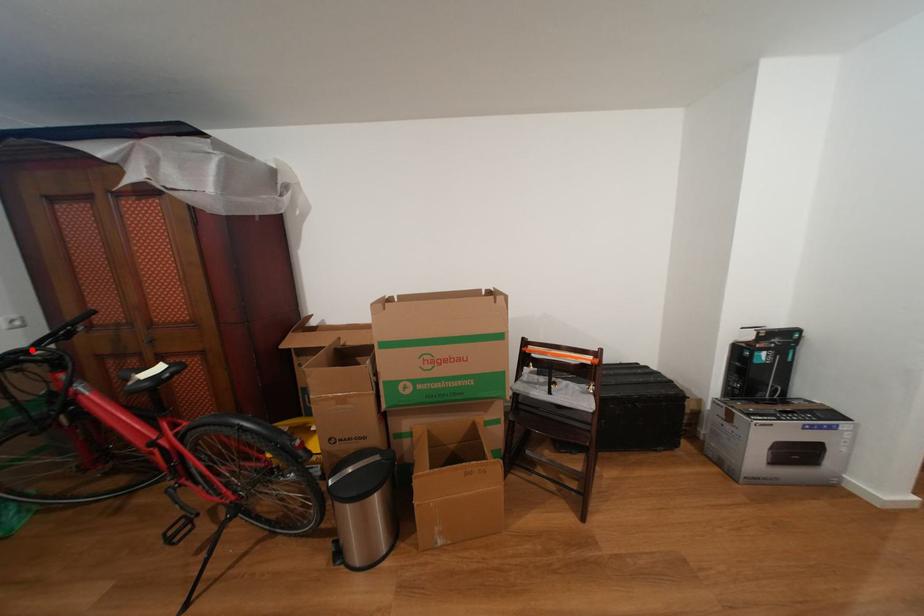
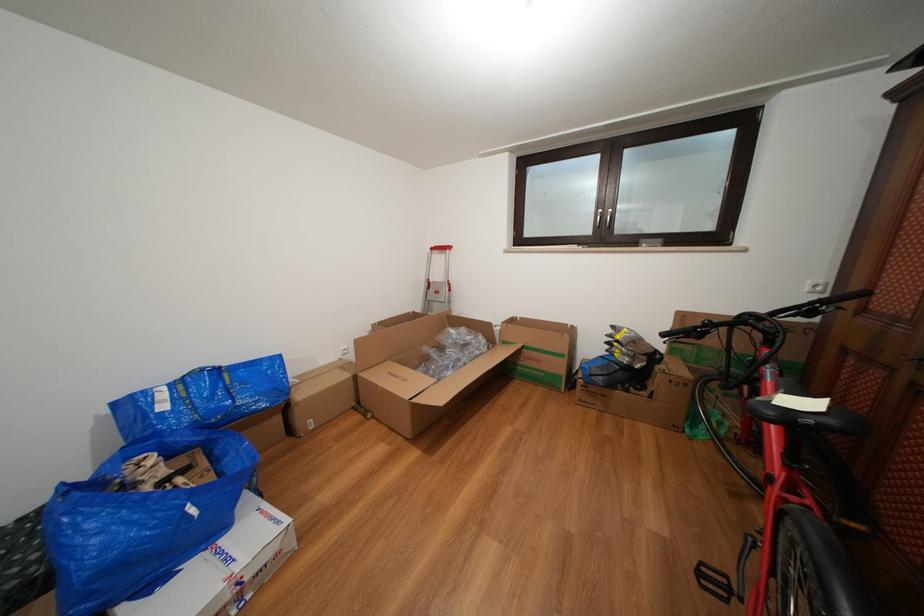
Question: I am providing you with two images of the same scene from different viewpoints. A red point is marked on the first image. At the location where the point appears in image 1, is it still visible in image 2?

Choices:
 (A) Yes
 (B) No

Answer: (A)